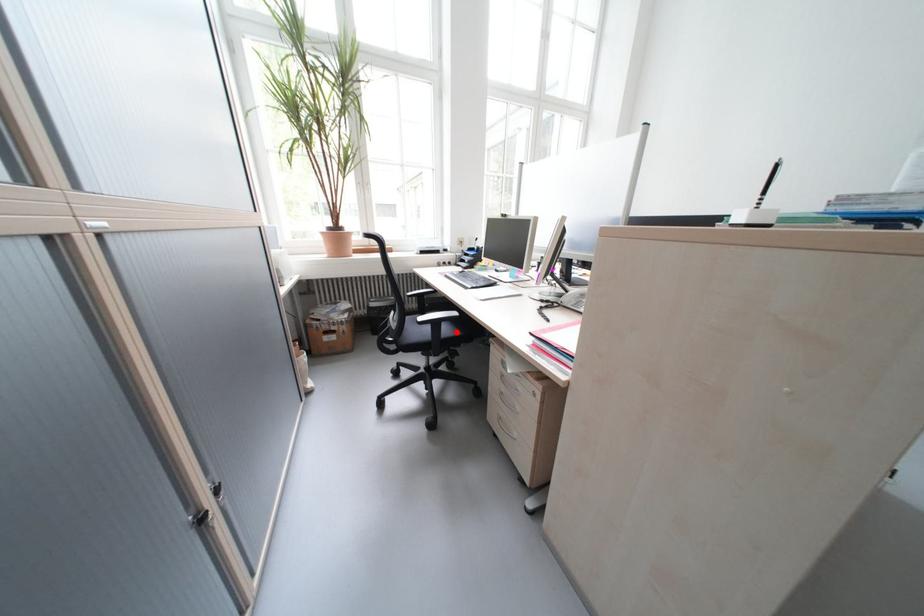
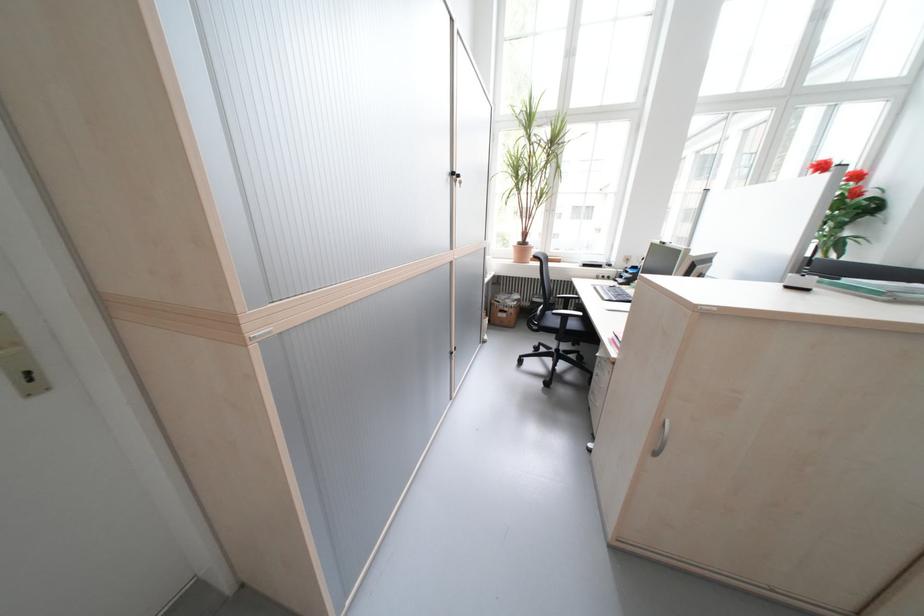
The point at the highlighted location is marked in the first image. Where is the corresponding point in the second image?

(582, 326)